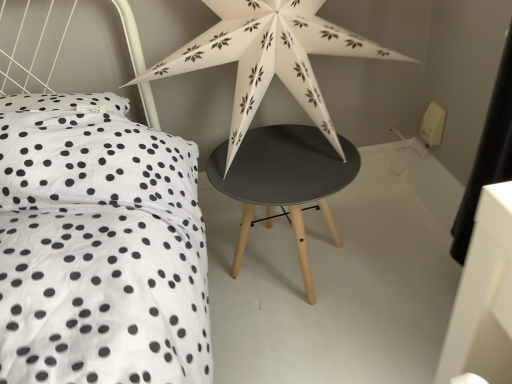
Question: Which is correct: white paper star at upper center is inside matte black stool at center, or outside of it?

Choices:
 (A) outside
 (B) inside

Answer: (A)

Question: Would you say white paper star at upper center is to the left or to the right of matte black stool at center in the picture?

Choices:
 (A) right
 (B) left

Answer: (B)

Question: Considering their positions, is white paper star at upper center located in front of or behind matte black stool at center?

Choices:
 (A) front
 (B) behind

Answer: (A)

Question: Considering the positions of matte black stool at center and white paper star at upper center in the image, is matte black stool at center taller or shorter than white paper star at upper center?

Choices:
 (A) short
 (B) tall

Answer: (A)

Question: Based on their positions, is matte black stool at center located to the left or right of white paper star at upper center?

Choices:
 (A) left
 (B) right

Answer: (B)

Question: In terms of width, does matte black stool at center look wider or thinner when compared to white paper star at upper center?

Choices:
 (A) wide
 (B) thin

Answer: (A)

Question: Is matte black stool at center in front of or behind white paper star at upper center in the image?

Choices:
 (A) behind
 (B) front

Answer: (A)